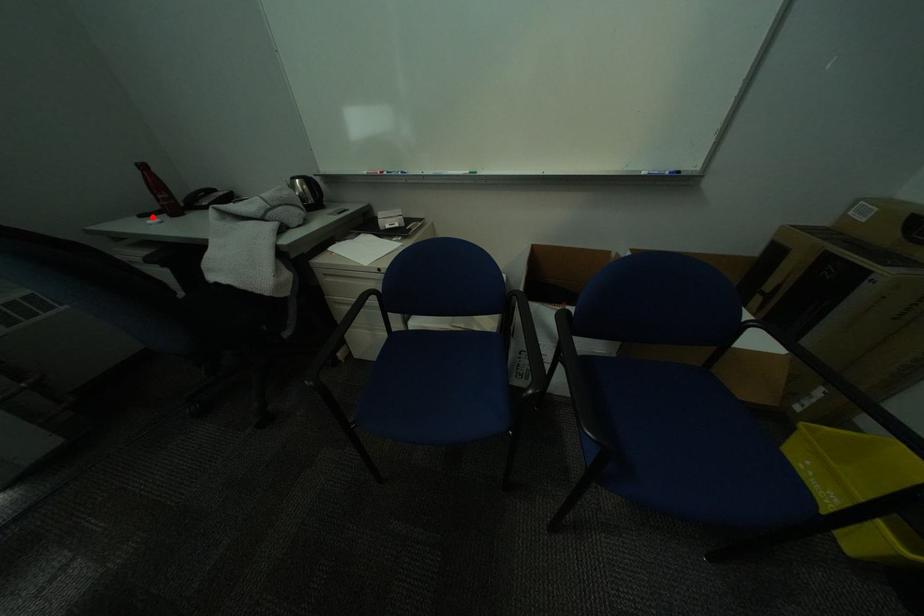
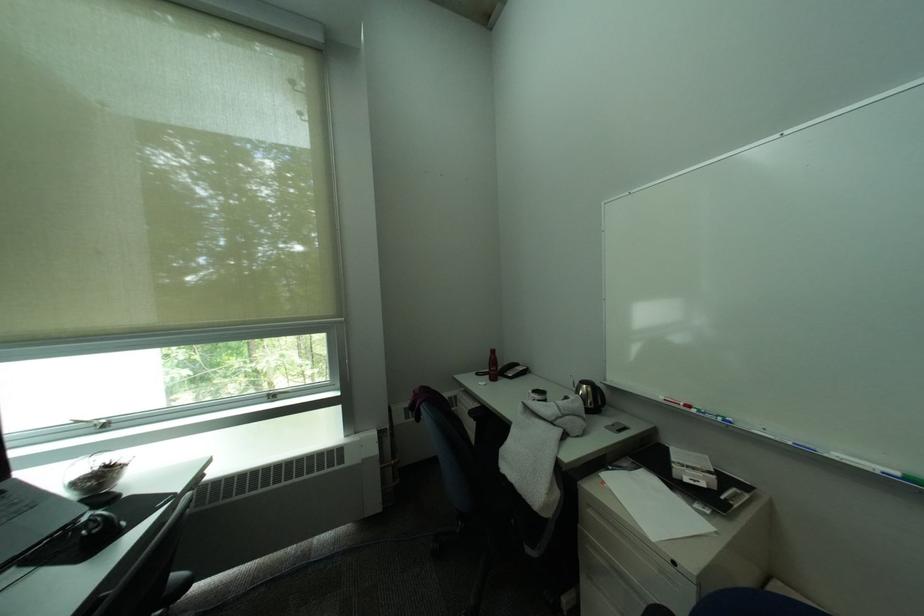
Where in the second image is the point corresponding to the highlighted location from the first image?

(488, 376)